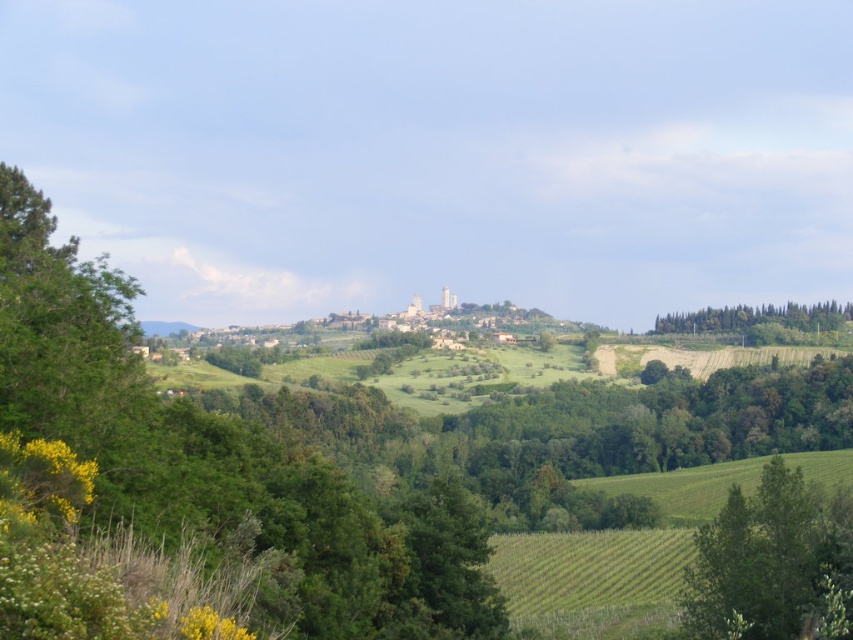
Between green leafy tree at lower right and green leafy trees at right, which one has less height?

With less height is green leafy trees at right.

Which is more to the left, green leafy tree at lower right or green leafy trees at right?

From the viewer's perspective, green leafy tree at lower right appears more on the left side.

Which is in front, point (773, 532) or point (730, 324)?

Point (773, 532)

The width and height of the screenshot is (853, 640). Identify the location of green leafy tree at lower right. (772, 563).